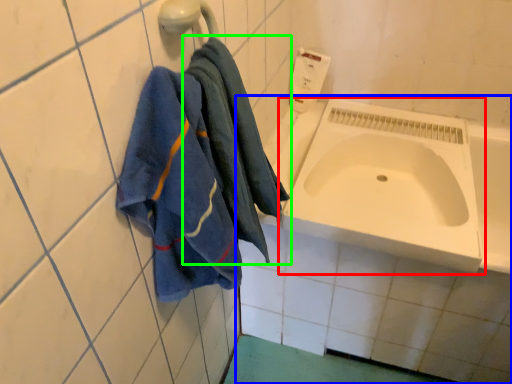
Question: Which object is the closest to the sink (highlighted by a red box)? Choose among these: bath (highlighted by a blue box) or towel (highlighted by a green box).

Choices:
 (A) bath
 (B) towel

Answer: (A)